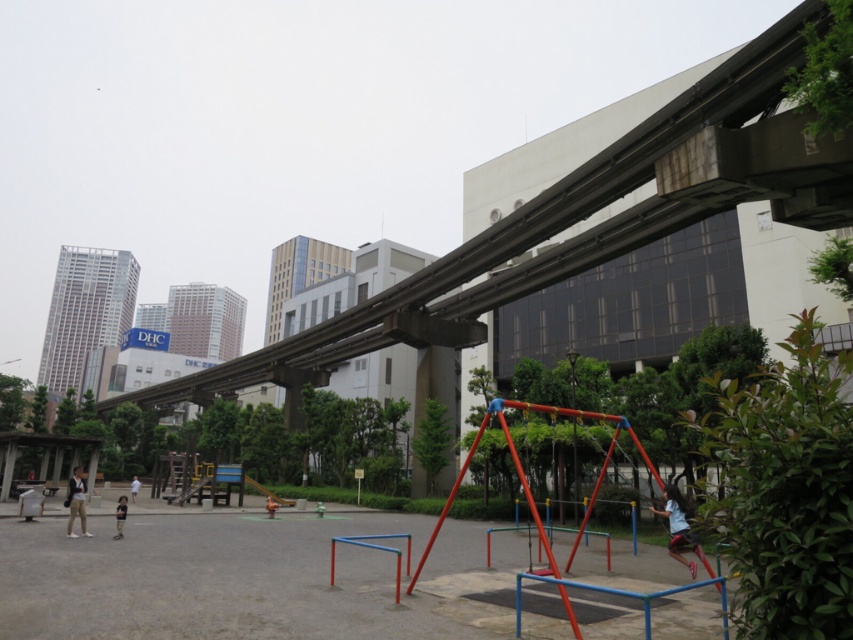
You are a parent trying to determine if your child can play on both the light blue fabric swing at center and the matte gray jacket at lower left simultaneously without them overlapping. Based on their sizes, is this possible?

The light blue fabric swing at center occupies less space than the matte gray jacket at lower left, so they can be placed without overlapping since the swing is smaller and the jacket is larger, allowing enough space between them.

You are standing at the center of the playground and want to pick up the light brown wooden toy at lower left located at point (120, 515). Which direction should you move to reach it?

The light brown wooden toy at lower left is located at point (120, 515), so you should move to the lower left direction to reach it.